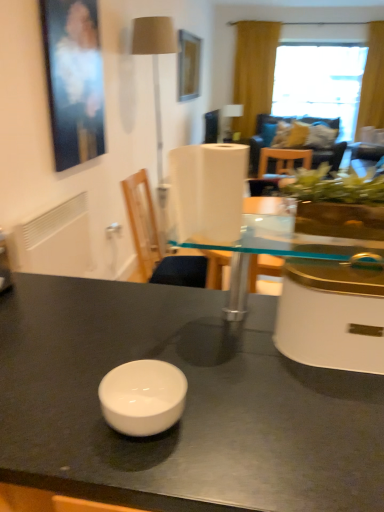
The image size is (384, 512). Find the location of `blank area beneath transparent glass table at center (from a real-world perspective)`. blank area beneath transparent glass table at center (from a real-world perspective) is located at coordinates (223, 302).